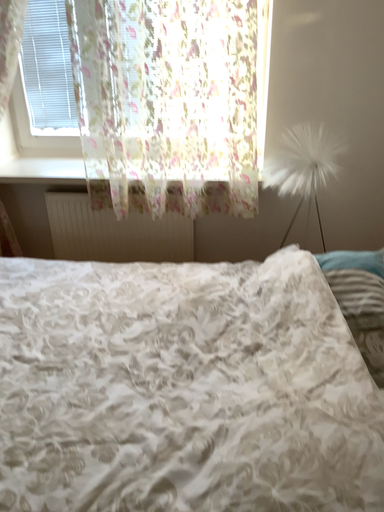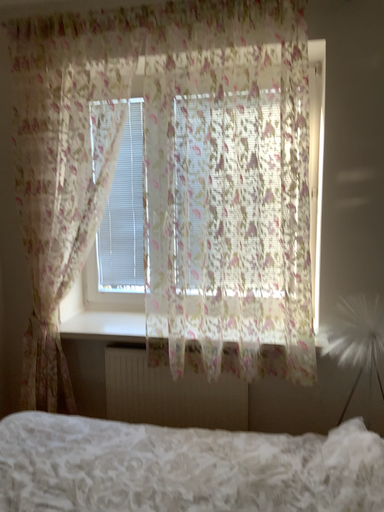
Question: Which way did the camera rotate in the video?

Choices:
 (A) rotated upward
 (B) rotated downward

Answer: (A)